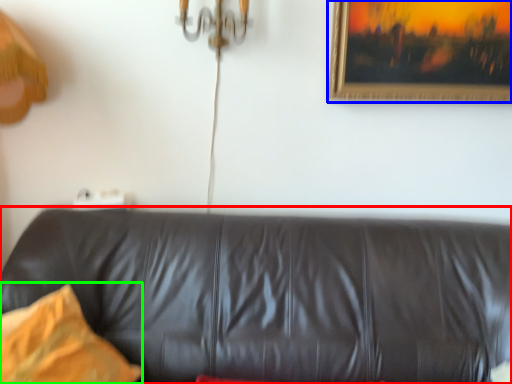
Question: Considering the real-world distances, which object is farthest from studio couch (highlighted by a red box)? picture frame (highlighted by a blue box) or pillow (highlighted by a green box)?

Choices:
 (A) picture frame
 (B) pillow

Answer: (A)